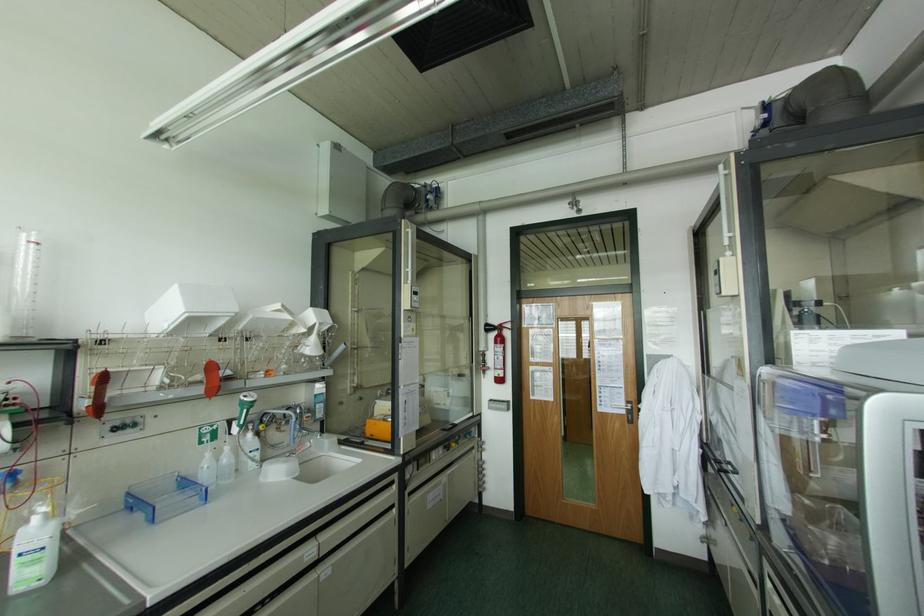
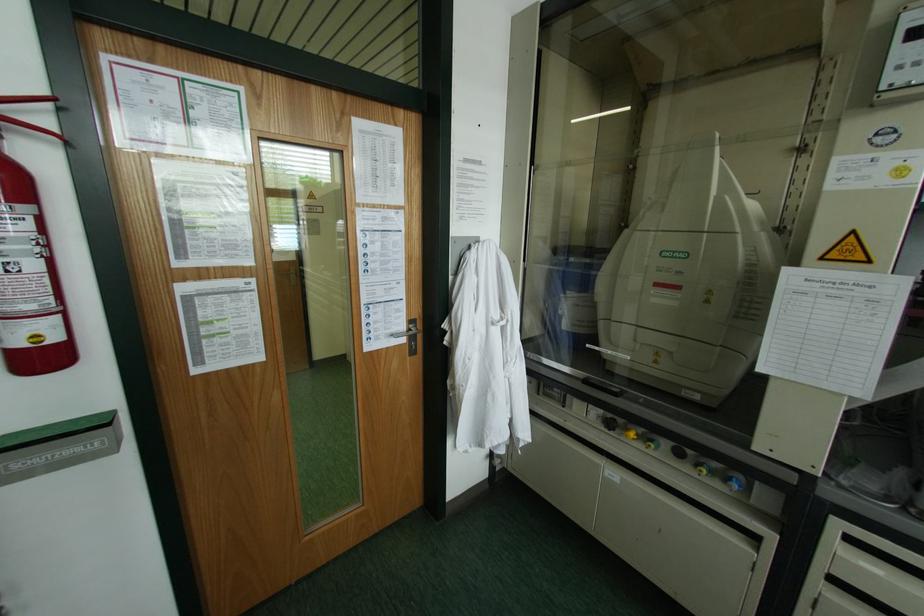
Find the pixel in the second image that matches point (626, 400) in the first image.

(409, 321)